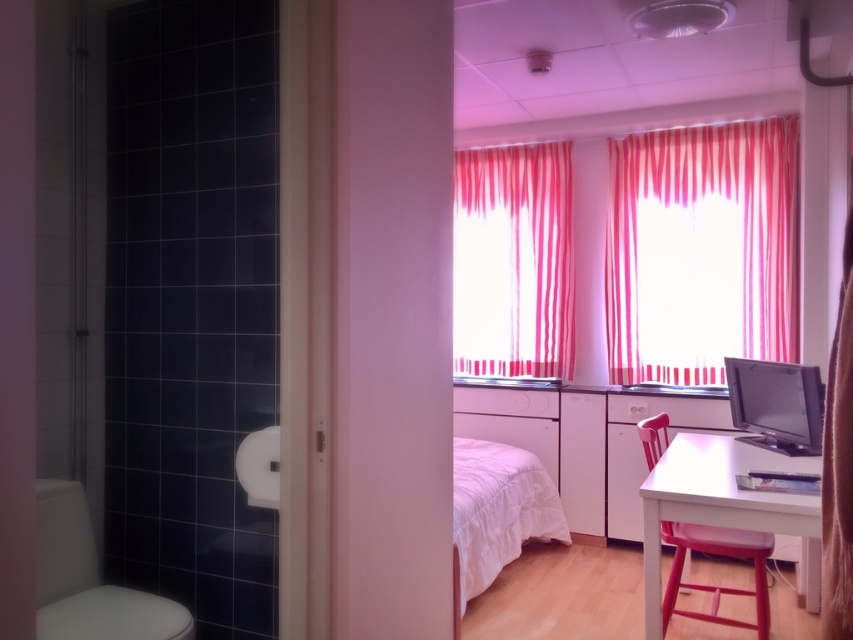
You are trying to decide whether to hang a new shelf above the pink striped curtain at center or the matte black monitor at right. Based on their heights, which object allows for a higher shelf placement?

The pink striped curtain at center is taller than the matte black monitor at right, so placing the shelf above the pink striped curtain at center would allow for a higher shelf placement.